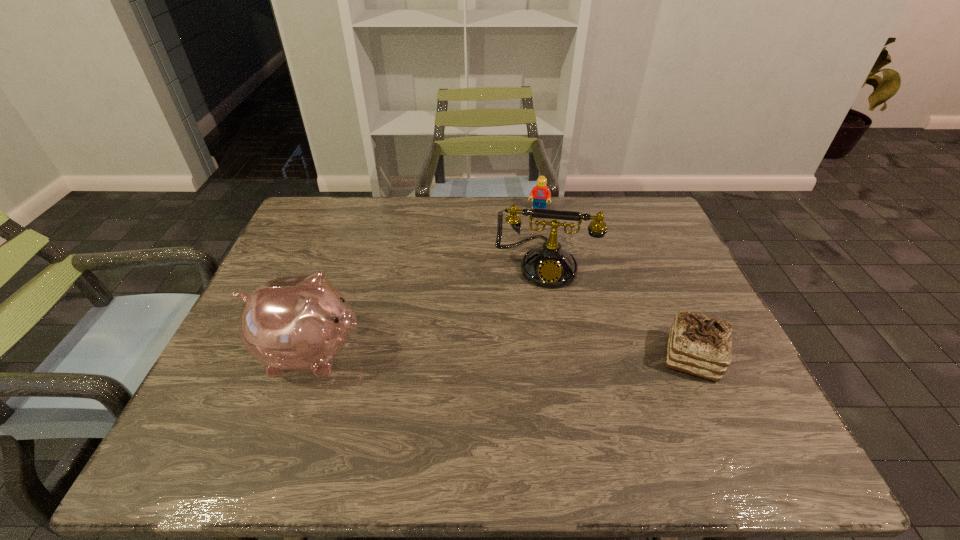
Locate an element on the screen. The image size is (960, 540). vacant space located on the dial of the third nearest object is located at coordinates (538, 340).

Where is `free spot located on the dial of the third nearest object`? The image size is (960, 540). free spot located on the dial of the third nearest object is located at coordinates (536, 371).

Locate an element on the screen. object positioned at the far edge is located at coordinates (540, 193).

This screenshot has height=540, width=960. In order to click on piggy bank at the near edge in this screenshot , I will do `click(299, 323)`.

Locate an element on the screen. The width and height of the screenshot is (960, 540). chocolate cake present at the near edge is located at coordinates pyautogui.click(x=700, y=345).

The height and width of the screenshot is (540, 960). I want to click on object at the left edge, so click(299, 323).

You are a GUI agent. You are given a task and a screenshot of the screen. Output one action in this format:
    pyautogui.click(x=<x>, y=<y>)
    Task: Click on the object located in the right edge section of the desktop
    Image resolution: width=960 pixels, height=540 pixels.
    Given the screenshot: What is the action you would take?
    pyautogui.click(x=700, y=345)

You are a GUI agent. You are given a task and a screenshot of the screen. Output one action in this format:
    pyautogui.click(x=<x>, y=<y>)
    Task: Click on the object that is positioned at the near left corner
    The height and width of the screenshot is (540, 960).
    Given the screenshot: What is the action you would take?
    pyautogui.click(x=299, y=323)

The image size is (960, 540). Find the location of `object that is at the near right corner`. object that is at the near right corner is located at coordinates (700, 345).

I want to click on vacant region at the far edge of the desktop, so click(x=595, y=212).